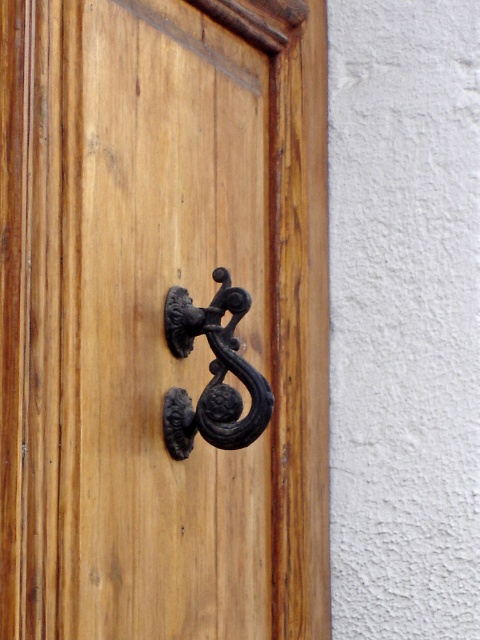
Who is more forward, (x=156, y=84) or (x=176, y=308)?

Point (x=176, y=308) is more forward.

Does matte black knocker at center have a greater height compared to black wrought iron door handle at center?

Yes.

Does point (239, 392) lie in front of point (211, 406)?

No, (239, 392) is behind (211, 406).

What are the coordinates of `matte black knocker at center` in the screenshot? It's located at (160, 316).